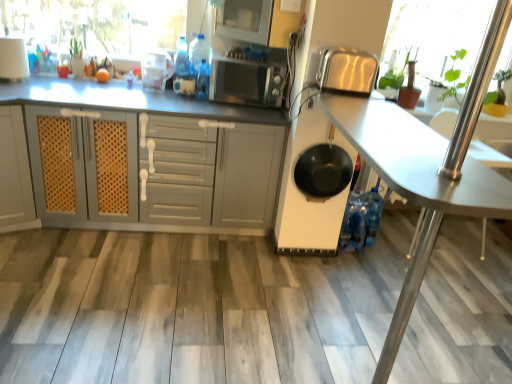
Question: Is satin silver microwave at center positioned beyond the bounds of white matte cabinet at center?

Choices:
 (A) no
 (B) yes

Answer: (B)

Question: Is satin silver microwave at center shorter than white matte cabinet at center?

Choices:
 (A) yes
 (B) no

Answer: (A)

Question: Does satin silver microwave at center appear on the left side of white matte cabinet at center?

Choices:
 (A) no
 (B) yes

Answer: (A)

Question: Is satin silver microwave at center far away from white matte cabinet at center?

Choices:
 (A) no
 (B) yes

Answer: (A)

Question: Does satin silver microwave at center have a lesser width compared to white matte cabinet at center?

Choices:
 (A) yes
 (B) no

Answer: (A)

Question: Does satin silver microwave at center come in front of white matte cabinet at center?

Choices:
 (A) yes
 (B) no

Answer: (B)

Question: From a real-world perspective, is white matte cabinet at center on green leafy plant at upper right, positioned as the 1th window screen in right-to-left order?

Choices:
 (A) no
 (B) yes

Answer: (A)

Question: Is white matte cabinet at center looking in the opposite direction of green leafy plant at upper right, the second window screen viewed from the left?

Choices:
 (A) no
 (B) yes

Answer: (A)

Question: Does white matte cabinet at center have a smaller size compared to green leafy plant at upper right, positioned as the 1th window screen in right-to-left order?

Choices:
 (A) yes
 (B) no

Answer: (B)

Question: Is white matte cabinet at center not close to green leafy plant at upper right, positioned as the 1th window screen in right-to-left order?

Choices:
 (A) no
 (B) yes

Answer: (B)

Question: From the image's perspective, is white matte cabinet at center on top of green leafy plant at upper right, positioned as the 1th window screen in right-to-left order?

Choices:
 (A) yes
 (B) no

Answer: (B)

Question: Considering the relative sizes of white matte cabinet at center and green leafy plant at upper right, positioned as the 1th window screen in right-to-left order, in the image provided, is white matte cabinet at center thinner than green leafy plant at upper right, positioned as the 1th window screen in right-to-left order,?

Choices:
 (A) yes
 (B) no

Answer: (B)

Question: From a real-world perspective, does transparent glass window screen at upper left, the first window screen positioned from the left, stand above black matte frying pan at center?

Choices:
 (A) no
 (B) yes

Answer: (B)